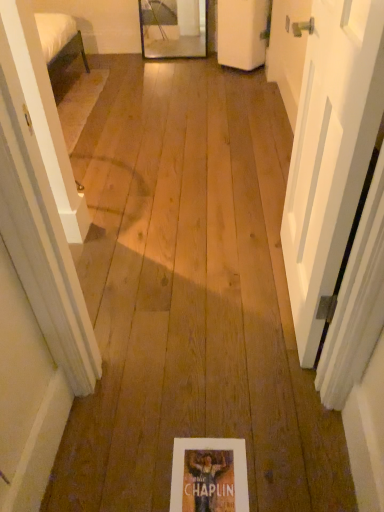
Question: Is white matte door at right, which appears as the 1th door when ordered from the bottom, taller or shorter than matte paper flyer at center?

Choices:
 (A) tall
 (B) short

Answer: (A)

Question: From a real-world perspective, is white matte door at right, placed as the second door when sorted from top to bottom, above or below matte paper flyer at center?

Choices:
 (A) below
 (B) above

Answer: (B)

Question: Which is nearer to the white matte door at upper center, the second door in the front-to-back sequence?

Choices:
 (A) white matte door at right, which appears as the 1th door when ordered from the bottom
 (B) matte paper flyer at center

Answer: (A)

Question: Considering the real-world distances, which object is closest to the white matte door at upper center, the second door in the front-to-back sequence?

Choices:
 (A) white matte door at right, which appears as the 1th door when ordered from the bottom
 (B) matte paper flyer at center

Answer: (A)